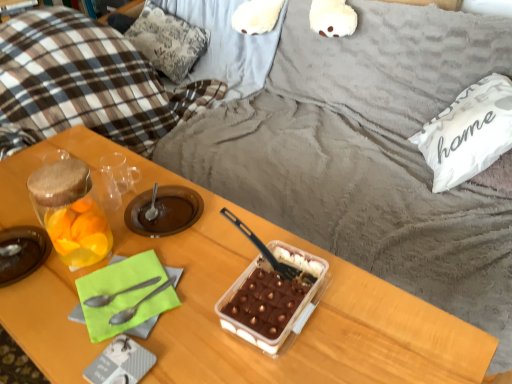
The image size is (512, 384). Find the location of `unoccupied space behind black plastic spoon at center, the third spoon from the left`. unoccupied space behind black plastic spoon at center, the third spoon from the left is located at coordinates pyautogui.click(x=245, y=230).